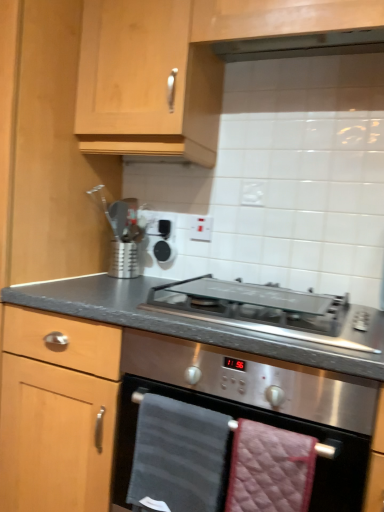
Question: Which direction should I rotate to look at quilted pink hand towel at lower center, the 2th hand towel from the left, — up or down?

Choices:
 (A) up
 (B) down

Answer: (B)

Question: Can you confirm if white plastic electric outlet at upper center is taller than light wood cabinet at upper center?

Choices:
 (A) yes
 (B) no

Answer: (B)

Question: Considering the relative positions of white plastic electric outlet at upper center and light wood cabinet at upper center in the image provided, is white plastic electric outlet at upper center behind light wood cabinet at upper center?

Choices:
 (A) yes
 (B) no

Answer: (A)

Question: Is white plastic electric outlet at upper center in front of light wood cabinet at upper center?

Choices:
 (A) yes
 (B) no

Answer: (B)

Question: From the image's perspective, is white plastic electric outlet at upper center over light wood cabinet at upper center?

Choices:
 (A) no
 (B) yes

Answer: (A)

Question: Is light wood cabinet at upper center surrounded by white plastic electric outlet at upper center?

Choices:
 (A) no
 (B) yes

Answer: (A)

Question: Does white plastic electric outlet at upper center appear on the left side of light wood cabinet at upper center?

Choices:
 (A) no
 (B) yes

Answer: (B)

Question: From the image's perspective, is stainless steel oven at center below quilted pink hand towel at lower center, the 2th hand towel from the left?

Choices:
 (A) no
 (B) yes

Answer: (A)

Question: Is stainless steel oven at center located outside quilted pink hand towel at lower center, the 2th hand towel from the left?

Choices:
 (A) yes
 (B) no

Answer: (A)

Question: Considering the relative sizes of stainless steel oven at center and quilted pink hand towel at lower center, the 2th hand towel from the left, in the image provided, is stainless steel oven at center taller than quilted pink hand towel at lower center, the 2th hand towel from the left,?

Choices:
 (A) yes
 (B) no

Answer: (A)

Question: Is there a large distance between stainless steel oven at center and quilted pink hand towel at lower center, which ranks as the first hand towel in right-to-left order?

Choices:
 (A) yes
 (B) no

Answer: (B)

Question: Does stainless steel oven at center turn towards quilted pink hand towel at lower center, the 2th hand towel from the left?

Choices:
 (A) no
 (B) yes

Answer: (B)

Question: From the image's perspective, does stainless steel oven at center appear higher than quilted pink hand towel at lower center, the 2th hand towel from the left?

Choices:
 (A) yes
 (B) no

Answer: (A)

Question: Is dark gray textured towel at center, positioned as the 1th hand towel in left-to-right order, positioned far away from quilted pink hand towel at lower center, which ranks as the first hand towel in right-to-left order?

Choices:
 (A) yes
 (B) no

Answer: (B)